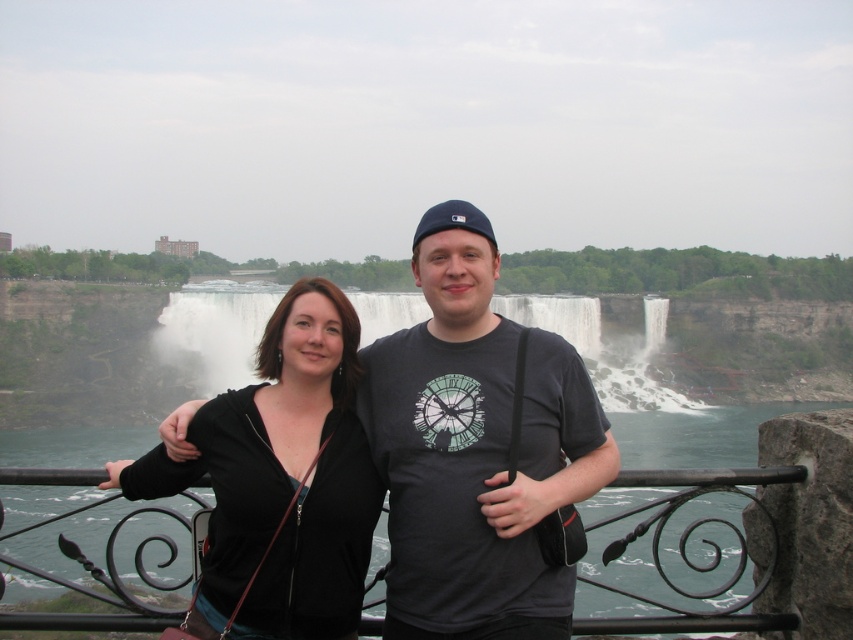
Does black matte jacket at center appear under black wrought iron railing at center?

Actually, black matte jacket at center is above black wrought iron railing at center.

Is black matte jacket at center taller than black wrought iron railing at center?

No.

Is point (112, 465) positioned before point (659, 483)?

No, (112, 465) is behind (659, 483).

Find the location of a particular element. black matte jacket at center is located at coordinates (281, 481).

Can you confirm if dark gray t-shirt at center is bigger than black wrought iron railing at center?

No, dark gray t-shirt at center is not bigger than black wrought iron railing at center.

Based on the photo, does dark gray t-shirt at center appear on the right side of black wrought iron railing at center?

No, dark gray t-shirt at center is not to the right of black wrought iron railing at center.

Which is behind, point (396, 612) or point (650, 484)?

Point (650, 484)

The width and height of the screenshot is (853, 640). What are the coordinates of `dark gray t-shirt at center` in the screenshot? It's located at (474, 449).

Is dark gray t-shirt at center taller than black matte jacket at center?

Yes.

Who is positioned more to the left, dark gray t-shirt at center or black matte jacket at center?

black matte jacket at center is more to the left.

The height and width of the screenshot is (640, 853). I want to click on dark gray t-shirt at center, so click(x=474, y=449).